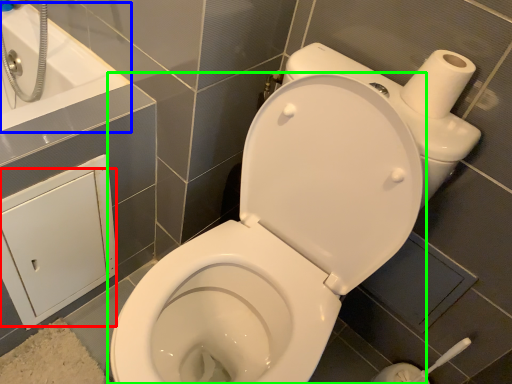
Question: Based on their relative distances, which object is nearer to screen door (highlighted by a red box)? Choose from bath (highlighted by a blue box) and toilet (highlighted by a green box).

Choices:
 (A) bath
 (B) toilet

Answer: (A)